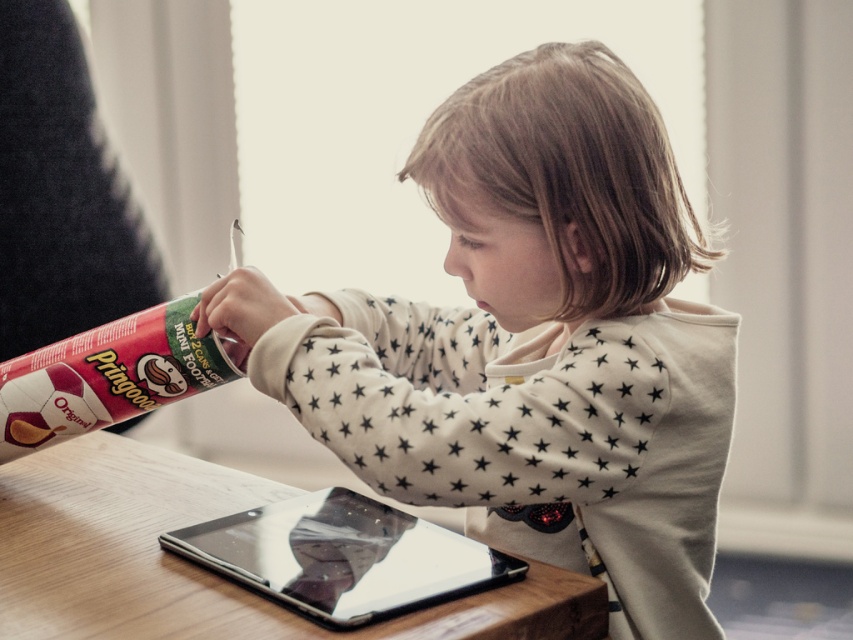
Question: Is white star-patterned sweater at center closer to camera compared to wooden table at center?

Choices:
 (A) yes
 (B) no

Answer: (B)

Question: Does white star-patterned sweater at center come behind transparent plastic tablet at center?

Choices:
 (A) yes
 (B) no

Answer: (A)

Question: Among these objects, which one is farthest from the camera?

Choices:
 (A) wooden table at center
 (B) transparent plastic tablet at center
 (C) white star-patterned sweater at center

Answer: (C)

Question: Is white star-patterned sweater at center closer to the viewer compared to transparent plastic tablet at center?

Choices:
 (A) yes
 (B) no

Answer: (B)

Question: Which point appears farthest from the camera in this image?

Choices:
 (A) (703, 308)
 (B) (376, 572)
 (C) (300, 621)

Answer: (A)

Question: Which is farther from the white star-patterned sweater at center?

Choices:
 (A) transparent plastic tablet at center
 (B) wooden table at center

Answer: (B)